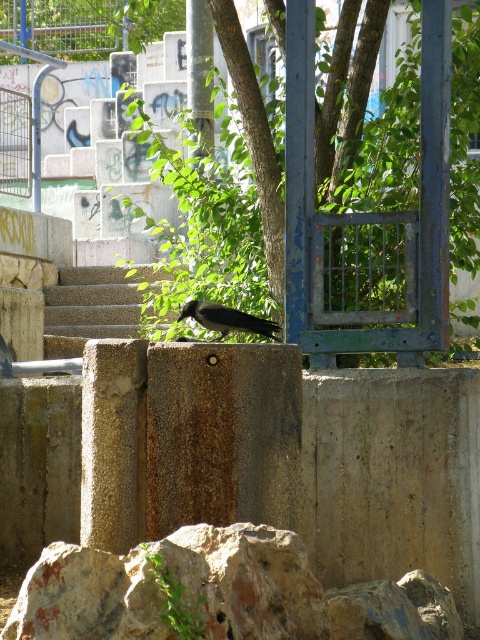
Question: Can you confirm if green leafy tree at center is smaller than shiny black crow at center?

Choices:
 (A) no
 (B) yes

Answer: (A)

Question: Based on their relative distances, which object is nearer to the shiny black crow at center?

Choices:
 (A) brown stone stairs at center
 (B) green leafy tree at center

Answer: (B)

Question: Does green leafy tree at center appear on the right side of shiny black crow at center?

Choices:
 (A) yes
 (B) no

Answer: (A)

Question: Does green leafy tree at center appear on the left side of brown stone stairs at center?

Choices:
 (A) no
 (B) yes

Answer: (A)

Question: Which object is closer to the camera taking this photo?

Choices:
 (A) green leafy tree at center
 (B) brown stone stairs at center
 (C) shiny black crow at center

Answer: (C)

Question: Which point is farther to the camera?

Choices:
 (A) green leafy tree at center
 (B) brown stone stairs at center

Answer: (B)